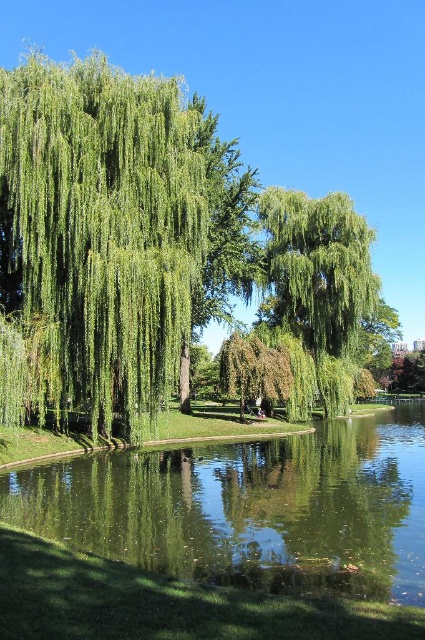
Question: Can you confirm if green leafy willow at left is smaller than green reflective water at center?

Choices:
 (A) no
 (B) yes

Answer: (A)

Question: Which point appears closest to the camera in this image?

Choices:
 (A) (81, 355)
 (B) (68, 497)

Answer: (B)

Question: Which point is closer to the camera taking this photo?

Choices:
 (A) (78, 177)
 (B) (350, 390)
 (C) (263, 582)

Answer: (C)

Question: Can you confirm if green leafy willow at left is positioned to the right of green reflective water at center?

Choices:
 (A) no
 (B) yes

Answer: (A)

Question: Based on their relative distances, which object is farther from the green reflective water at center?

Choices:
 (A) green leafy willow at left
 (B) green leafy willow at center

Answer: (B)

Question: Does green leafy willow at left have a larger size compared to green leafy willow at center?

Choices:
 (A) no
 (B) yes

Answer: (B)